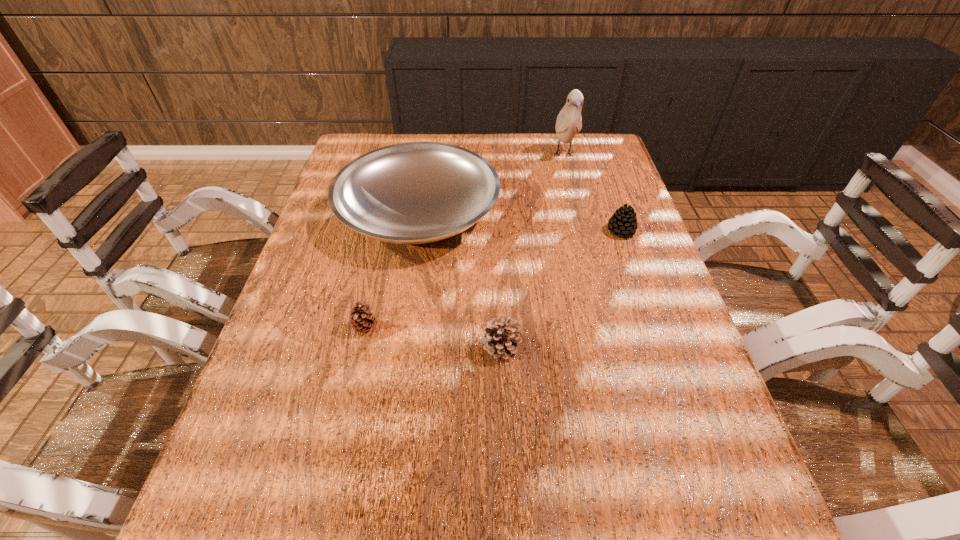
Find the location of a particular element. This screenshot has height=540, width=960. pinecone object that ranks as the closest to the bedpan is located at coordinates pos(362,320).

Find the location of a particular element. vacant point that satisfies the following two spatial constraints: 1. at the narrow end of the rightmost object; 2. on the front side of the second pinecone from right to left is located at coordinates (660, 346).